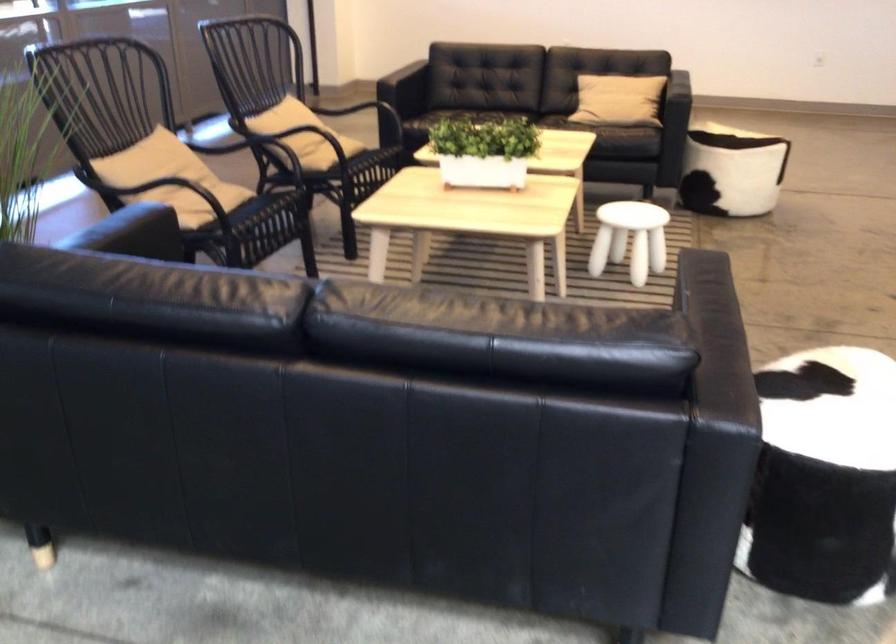
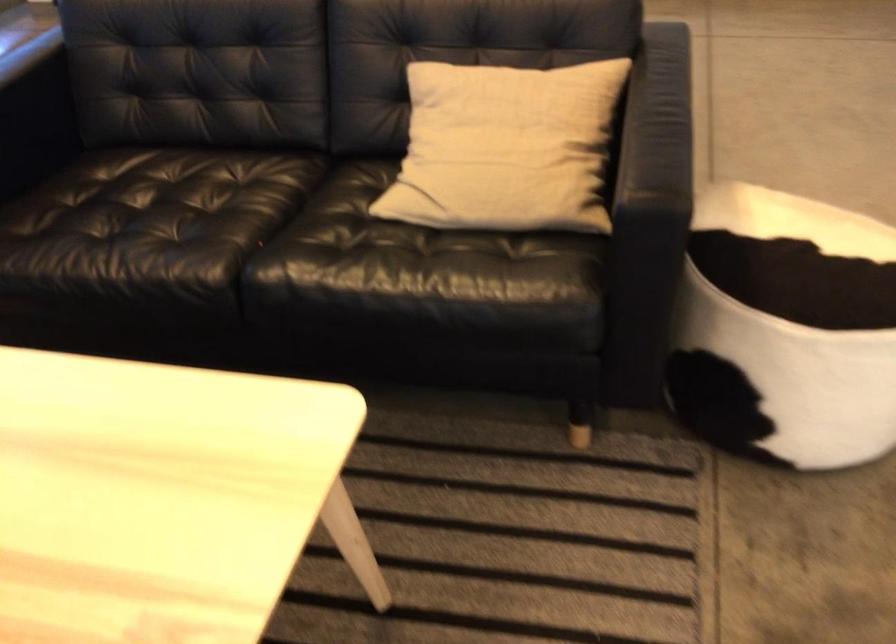
Question: The images are taken continuously from a first-person perspective. In which direction are you moving?

Choices:
 (A) Left
 (B) Right
 (C) Forward
 (D) Backward

Answer: (C)